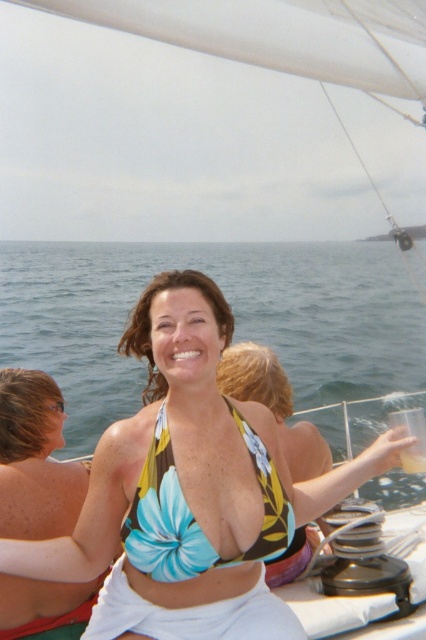
Question: Which of the following is the farthest from the observer?

Choices:
 (A) clear plastic cup at upper right
 (B) translucent plastic cup at upper right
 (C) clear blue water at center

Answer: (C)

Question: Is blue floral bikini top at center bigger than clear plastic cup at upper right?

Choices:
 (A) yes
 (B) no

Answer: (A)

Question: Among these objects, which one is nearest to the camera?

Choices:
 (A) blue floral bikini top at center
 (B) matte skin at upper left
 (C) clear plastic cup at upper right

Answer: (A)

Question: Is matte skin at upper left to the right of blue floral bikini top at center from the viewer's perspective?

Choices:
 (A) yes
 (B) no

Answer: (B)

Question: Is matte skin at upper left to the right of clear plastic cup at upper right from the viewer's perspective?

Choices:
 (A) yes
 (B) no

Answer: (B)

Question: Which of the following is the farthest from the observer?

Choices:
 (A) (25, 269)
 (B) (419, 464)

Answer: (A)